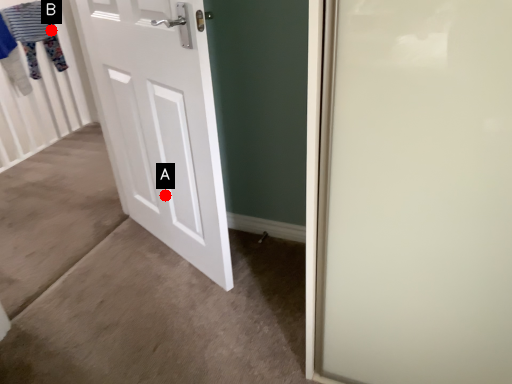
Question: Two points are circled on the image, labeled by A and B beside each circle. Which point appears farthest from the camera in this image?

Choices:
 (A) A is further
 (B) B is further

Answer: (B)